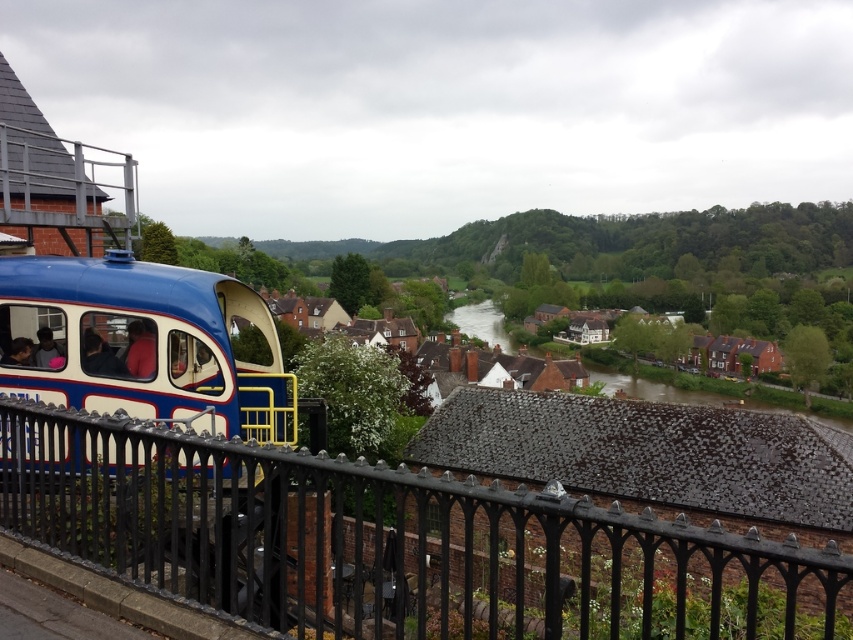
Question: Which point is farther to the camera?

Choices:
 (A) matte blue train car at left
 (B) clear water at center

Answer: (B)

Question: Which point is farther to the camera?

Choices:
 (A) (474, 314)
 (B) (216, 340)

Answer: (A)

Question: Does black wrought iron fence at lower left have a larger size compared to matte blue train car at left?

Choices:
 (A) yes
 (B) no

Answer: (A)

Question: Which point appears farthest from the camera in this image?

Choices:
 (A) (468, 328)
 (B) (143, 307)

Answer: (A)

Question: Does matte blue train car at left have a smaller size compared to clear water at center?

Choices:
 (A) no
 (B) yes

Answer: (B)

Question: Does black wrought iron fence at lower left come behind clear water at center?

Choices:
 (A) no
 (B) yes

Answer: (A)